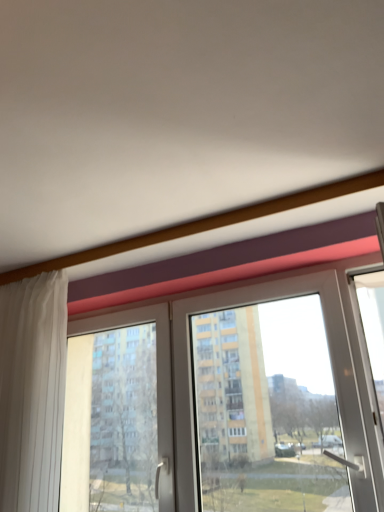
Where is `white sheer curtain at left`? white sheer curtain at left is located at coordinates (32, 390).

The height and width of the screenshot is (512, 384). What do you see at coordinates (32, 390) in the screenshot?
I see `white sheer curtain at left` at bounding box center [32, 390].

In order to face white sheer curtain at left, should I rotate leftwards or rightwards?

It's best to rotate left around 24.139 degrees.

What do you see at coordinates (220, 404) in the screenshot?
I see `transparent glass window at center` at bounding box center [220, 404].

The height and width of the screenshot is (512, 384). I want to click on transparent glass window at center, so click(220, 404).

The height and width of the screenshot is (512, 384). I want to click on white sheer curtain at left, so click(32, 390).

Does white sheer curtain at left appear on the left side of transparent glass window at center?

Yes, white sheer curtain at left is to the left of transparent glass window at center.

Is the depth of white sheer curtain at left less than that of transparent glass window at center?

No, it is behind transparent glass window at center.

Does point (58, 451) come in front of point (117, 403)?

Yes, it is.

From the image's perspective, does white sheer curtain at left appear lower than transparent glass window at center?

Yes, from the image's perspective, white sheer curtain at left is below transparent glass window at center.

From a real-world perspective, which object stands above the other?

white sheer curtain at left is physically above.

Is white sheer curtain at left thinner than transparent glass window at center?

Yes, white sheer curtain at left is thinner than transparent glass window at center.

Between white sheer curtain at left and transparent glass window at center, which one has less height?

transparent glass window at center.

Between white sheer curtain at left and transparent glass window at center, which one has smaller size?

white sheer curtain at left is smaller.

Can we say white sheer curtain at left lies outside transparent glass window at center?

No, most part of white sheer curtain at left lies within transparent glass window at center.

Consider the image. Is white sheer curtain at left far from transparent glass window at center?

No, white sheer curtain at left is not far away from transparent glass window at center.

Could you tell me if white sheer curtain at left is facing transparent glass window at center?

No, white sheer curtain at left is not turned towards transparent glass window at center.

How different are the orientations of white sheer curtain at left and transparent glass window at center in degrees?

2.33 degrees.

How far apart are white sheer curtain at left and transparent glass window at center?

A distance of 81.49 centimeters exists between white sheer curtain at left and transparent glass window at center.

Find the location of `curtain lying on the left of transparent glass window at center`. curtain lying on the left of transparent glass window at center is located at coordinates (32, 390).

Which object is positioned more to the right, transparent glass window at center or white sheer curtain at left?

transparent glass window at center is more to the right.

Is transparent glass window at center closer to camera compared to white sheer curtain at left?

Yes, it is.

Between point (203, 429) and point (57, 279), which one is positioned behind?

The point (203, 429) is more distant.

From the image's perspective, would you say transparent glass window at center is shown under white sheer curtain at left?

No, from the image's perspective, transparent glass window at center is not below white sheer curtain at left.

From a real-world perspective, relative to white sheer curtain at left, is transparent glass window at center vertically above or below?

transparent glass window at center is situated lower than white sheer curtain at left in the real world.

Does transparent glass window at center have a lesser width compared to white sheer curtain at left?

Incorrect, the width of transparent glass window at center is not less than that of white sheer curtain at left.

Considering the sizes of objects transparent glass window at center and white sheer curtain at left in the image provided, who is shorter, transparent glass window at center or white sheer curtain at left?

transparent glass window at center.

Based on their sizes in the image, would you say transparent glass window at center is bigger or smaller than white sheer curtain at left?

transparent glass window at center is bigger than white sheer curtain at left.

Is transparent glass window at center inside the boundaries of white sheer curtain at left, or outside?

transparent glass window at center exists outside the volume of white sheer curtain at left.

Does transparent glass window at center touch white sheer curtain at left?

No, transparent glass window at center is not making contact with white sheer curtain at left.

Is white sheer curtain at left at the back of transparent glass window at center?

No, white sheer curtain at left is not at the back of transparent glass window at center.

This screenshot has height=512, width=384. Find the location of `window located underneath the white sheer curtain at left (from a real-world perspective)`. window located underneath the white sheer curtain at left (from a real-world perspective) is located at coordinates (220, 404).

Locate an element on the screen. The height and width of the screenshot is (512, 384). window above the white sheer curtain at left (from the image's perspective) is located at coordinates (220, 404).

Identify the location of window on the right of white sheer curtain at left. (220, 404).